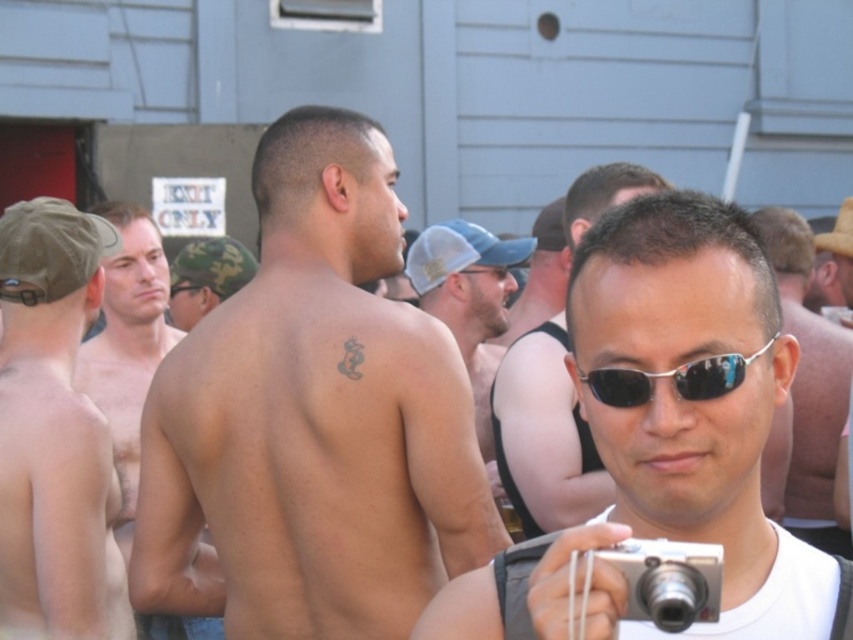
Does white matte camera at center appear on the left side of silver metallic sunglasses at center?

Incorrect, white matte camera at center is not on the left side of silver metallic sunglasses at center.

Does point (646, 314) come closer to viewer compared to point (727, 372)?

No, it is not.

Find the location of `white matte camera at center`. white matte camera at center is located at coordinates (686, 408).

Can you confirm if white matte camera at center is positioned above hairless skin at left?

No.

Does white matte camera at center have a smaller size compared to hairless skin at left?

Correct, white matte camera at center occupies less space than hairless skin at left.

Is point (757, 280) closer to camera compared to point (141, 340)?

That is True.

This screenshot has height=640, width=853. I want to click on white matte camera at center, so click(x=686, y=408).

Who is positioned more to the right, white matte camera at center or silver metallic camera at lower right?

Positioned to the right is white matte camera at center.

Between point (698, 301) and point (715, 612), which one is positioned behind?

The point (698, 301) is more distant.

This screenshot has height=640, width=853. Find the location of `white matte camera at center`. white matte camera at center is located at coordinates (686, 408).